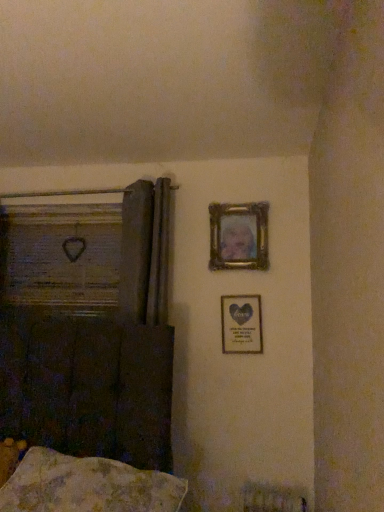
The width and height of the screenshot is (384, 512). What do you see at coordinates (239, 236) in the screenshot? I see `gold metallic picture frame at upper center, positioned as the second picture frame in bottom-to-top order` at bounding box center [239, 236].

What are the coordinates of `metallic gold picture frame at center-right, the second picture frame positioned from the top` in the screenshot? It's located at (241, 324).

Who is bigger, metallic gold picture frame at center-right, which is the 1th picture frame in bottom-to-top order, or wooden frame at left?

Bigger between the two is wooden frame at left.

From the image's perspective, is metallic gold picture frame at center-right, which is the 1th picture frame in bottom-to-top order, beneath wooden frame at left?

Yes, from the image's perspective, metallic gold picture frame at center-right, which is the 1th picture frame in bottom-to-top order, is below wooden frame at left.

Who is shorter, metallic gold picture frame at center-right, the second picture frame positioned from the top, or wooden frame at left?

metallic gold picture frame at center-right, the second picture frame positioned from the top.

Which point is more forward, (255, 296) or (10, 253)?

The point (255, 296) is closer to the camera.

Between wooden frame at left and fluffy beige pillow at lower left, which one has smaller size?

wooden frame at left is smaller.

Is wooden frame at left far from fluffy beige pillow at lower left?

Indeed, wooden frame at left is not near fluffy beige pillow at lower left.

Considering the points (47, 230) and (67, 480), which point is behind, point (47, 230) or point (67, 480)?

The point (47, 230) is behind.

Would you say wooden frame at left is outside fluffy beige pillow at lower left?

That's correct, wooden frame at left is outside of fluffy beige pillow at lower left.

From the image's perspective, is fluffy beige pillow at lower left below metallic gold picture frame at center-right, the second picture frame positioned from the top?

Correct, fluffy beige pillow at lower left appears lower than metallic gold picture frame at center-right, the second picture frame positioned from the top, in the image.

Is fluffy beige pillow at lower left next to metallic gold picture frame at center-right, the second picture frame positioned from the top, and touching it?

fluffy beige pillow at lower left is not next to metallic gold picture frame at center-right, the second picture frame positioned from the top, and they're not touching.

Considering the relative sizes of fluffy beige pillow at lower left and metallic gold picture frame at center-right, the second picture frame positioned from the top, in the image provided, is fluffy beige pillow at lower left taller than metallic gold picture frame at center-right, the second picture frame positioned from the top,?

No.

From a real-world perspective, which object rests below the other?

In real-world perspective, metallic gold picture frame at center-right, the second picture frame positioned from the top, is lower.

Where is `picture frame located on the right of gold metallic picture frame at upper center, positioned as the second picture frame in bottom-to-top order`? picture frame located on the right of gold metallic picture frame at upper center, positioned as the second picture frame in bottom-to-top order is located at coordinates (241, 324).

Can you confirm if gold metallic picture frame at upper center, the 1th picture frame in the top-to-bottom sequence, is shorter than metallic gold picture frame at center-right, which is the 1th picture frame in bottom-to-top order?

No, gold metallic picture frame at upper center, the 1th picture frame in the top-to-bottom sequence, is not shorter than metallic gold picture frame at center-right, which is the 1th picture frame in bottom-to-top order.

Is wooden frame at left oriented away from metallic gold picture frame at center-right, the second picture frame positioned from the top?

No, wooden frame at left's orientation is not away from metallic gold picture frame at center-right, the second picture frame positioned from the top.

Can you confirm if wooden frame at left is bigger than metallic gold picture frame at center-right, which is the 1th picture frame in bottom-to-top order?

Yes.

Looking at this image, from their relative heights in the image, would you say wooden frame at left is taller or shorter than metallic gold picture frame at center-right, the second picture frame positioned from the top?

Clearly, wooden frame at left is taller compared to metallic gold picture frame at center-right, the second picture frame positioned from the top.

Is point (79, 248) behind point (240, 321)?

Yes, it is behind point (240, 321).

Is wooden frame at left next to gold metallic picture frame at upper center, the 1th picture frame in the top-to-bottom sequence?

wooden frame at left and gold metallic picture frame at upper center, the 1th picture frame in the top-to-bottom sequence, are clearly separated.

Is wooden frame at left bigger than gold metallic picture frame at upper center, the 1th picture frame in the top-to-bottom sequence?

Yes.

Considering the sizes of objects wooden frame at left and gold metallic picture frame at upper center, the 1th picture frame in the top-to-bottom sequence, in the image provided, who is wider, wooden frame at left or gold metallic picture frame at upper center, the 1th picture frame in the top-to-bottom sequence,?

wooden frame at left is wider.

Considering the sizes of gold metallic picture frame at upper center, the 1th picture frame in the top-to-bottom sequence, and fluffy beige pillow at lower left in the image, is gold metallic picture frame at upper center, the 1th picture frame in the top-to-bottom sequence, bigger or smaller than fluffy beige pillow at lower left?

Clearly, gold metallic picture frame at upper center, the 1th picture frame in the top-to-bottom sequence, is smaller in size than fluffy beige pillow at lower left.

Does point (210, 242) appear closer or farther from the camera than point (144, 489)?

Point (210, 242).

Is gold metallic picture frame at upper center, the 1th picture frame in the top-to-bottom sequence, touching fluffy beige pillow at lower left?

No, gold metallic picture frame at upper center, the 1th picture frame in the top-to-bottom sequence, is not in contact with fluffy beige pillow at lower left.

Is fluffy beige pillow at lower left located within gold metallic picture frame at upper center, positioned as the second picture frame in bottom-to-top order?

No, fluffy beige pillow at lower left is not a part of gold metallic picture frame at upper center, positioned as the second picture frame in bottom-to-top order.

Identify the location of window frame above the metallic gold picture frame at center-right, the second picture frame positioned from the top (from the image's perspective). (62, 256).

At what (x,y) coordinates should I click in order to perform the action: click on window frame to the left of fluffy beige pillow at lower left. Please return your answer as a coordinate pair (x, y). This screenshot has height=512, width=384. Looking at the image, I should click on (62, 256).

Considering their positions, is wooden frame at left positioned closer to gold metallic picture frame at upper center, positioned as the second picture frame in bottom-to-top order, than fluffy beige pillow at lower left?

wooden frame at left.

Which object lies further to the anchor point metallic gold picture frame at center-right, the second picture frame positioned from the top, wooden frame at left or gold metallic picture frame at upper center, positioned as the second picture frame in bottom-to-top order?

wooden frame at left lies further to metallic gold picture frame at center-right, the second picture frame positioned from the top, than the other object.

Based on their spatial positions, is metallic gold picture frame at center-right, the second picture frame positioned from the top, or wooden frame at left further from gold metallic picture frame at upper center, the 1th picture frame in the top-to-bottom sequence?

wooden frame at left.

Which object lies further to the anchor point fluffy beige pillow at lower left, wooden frame at left or metallic gold picture frame at center-right, which is the 1th picture frame in bottom-to-top order?

wooden frame at left is positioned further to the anchor fluffy beige pillow at lower left.

Looking at the image, which one is located further to wooden frame at left, fluffy beige pillow at lower left or gold metallic picture frame at upper center, positioned as the second picture frame in bottom-to-top order?

fluffy beige pillow at lower left.

Based on their spatial positions, is fluffy beige pillow at lower left or metallic gold picture frame at center-right, the second picture frame positioned from the top, further from gold metallic picture frame at upper center, positioned as the second picture frame in bottom-to-top order?

Among the two, fluffy beige pillow at lower left is located further to gold metallic picture frame at upper center, positioned as the second picture frame in bottom-to-top order.

Consider the image. Which object lies nearer to the anchor point gold metallic picture frame at upper center, the 1th picture frame in the top-to-bottom sequence, fluffy beige pillow at lower left or wooden frame at left?

wooden frame at left lies closer to gold metallic picture frame at upper center, the 1th picture frame in the top-to-bottom sequence, than the other object.

Based on their spatial positions, is metallic gold picture frame at center-right, the second picture frame positioned from the top, or fluffy beige pillow at lower left closer to gold metallic picture frame at upper center, the 1th picture frame in the top-to-bottom sequence?

Among the two, metallic gold picture frame at center-right, the second picture frame positioned from the top, is located nearer to gold metallic picture frame at upper center, the 1th picture frame in the top-to-bottom sequence.

The image size is (384, 512). What are the coordinates of `picture frame between gold metallic picture frame at upper center, the 1th picture frame in the top-to-bottom sequence, and fluffy beige pillow at lower left vertically` in the screenshot? It's located at (241, 324).

You are a GUI agent. You are given a task and a screenshot of the screen. Output one action in this format:
    pyautogui.click(x=<x>, y=<y>)
    Task: Click on the picture frame located between wooden frame at left and metallic gold picture frame at center-right, the second picture frame positioned from the top, in the left-right direction
    
    Given the screenshot: What is the action you would take?
    pyautogui.click(x=239, y=236)